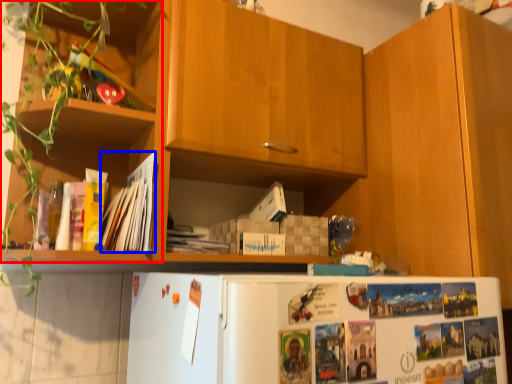
Question: Which object appears farthest to the camera in this image, shelf (highlighted by a red box) or magazine (highlighted by a blue box)?

Choices:
 (A) shelf
 (B) magazine

Answer: (B)